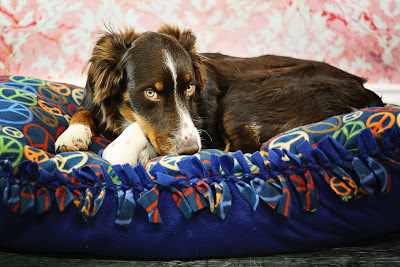
This screenshot has width=400, height=267. In order to click on white baseboard in this screenshot , I will do `click(390, 91)`.